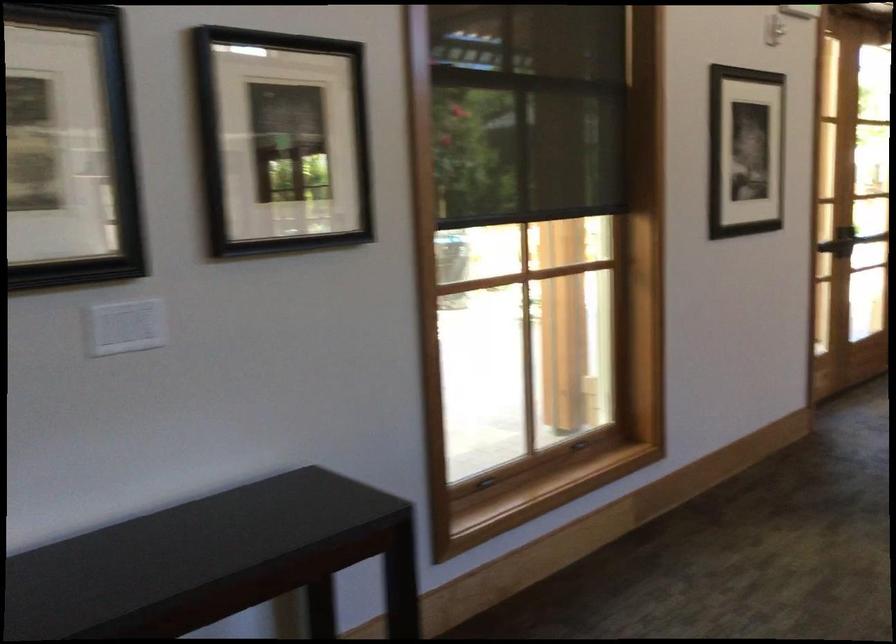
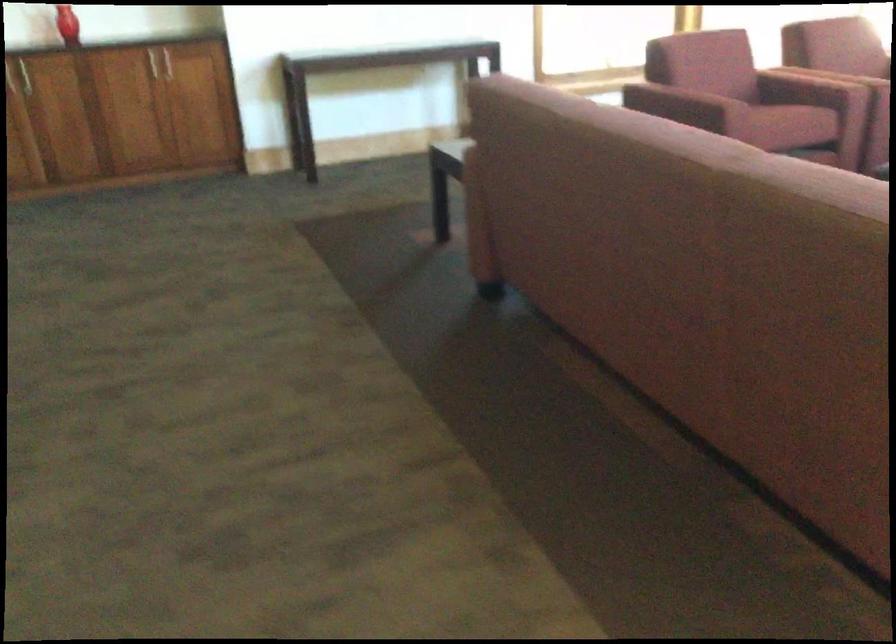
In a continuous first-person perspective shot, in which direction is the camera moving?

The movement direction of the cameraman is right, backward.